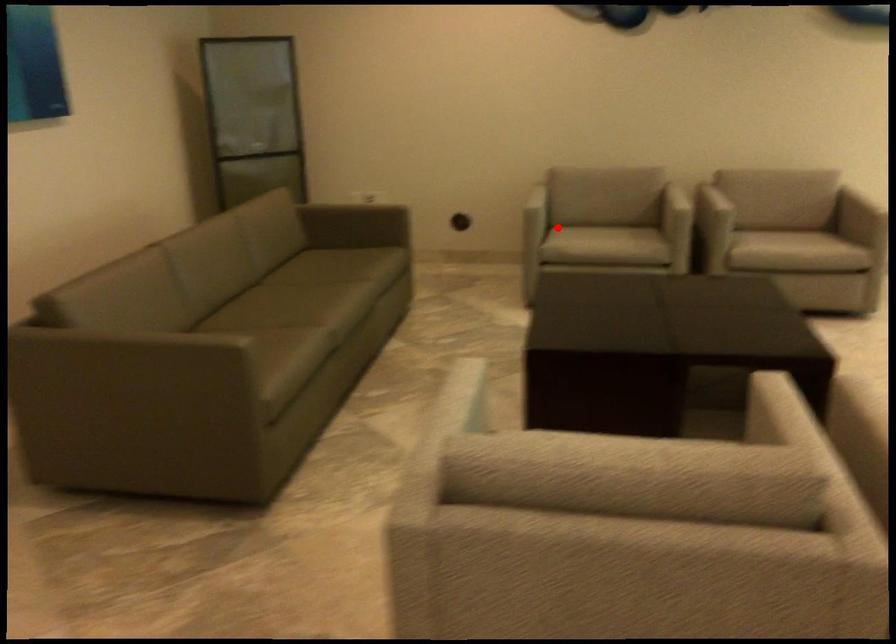
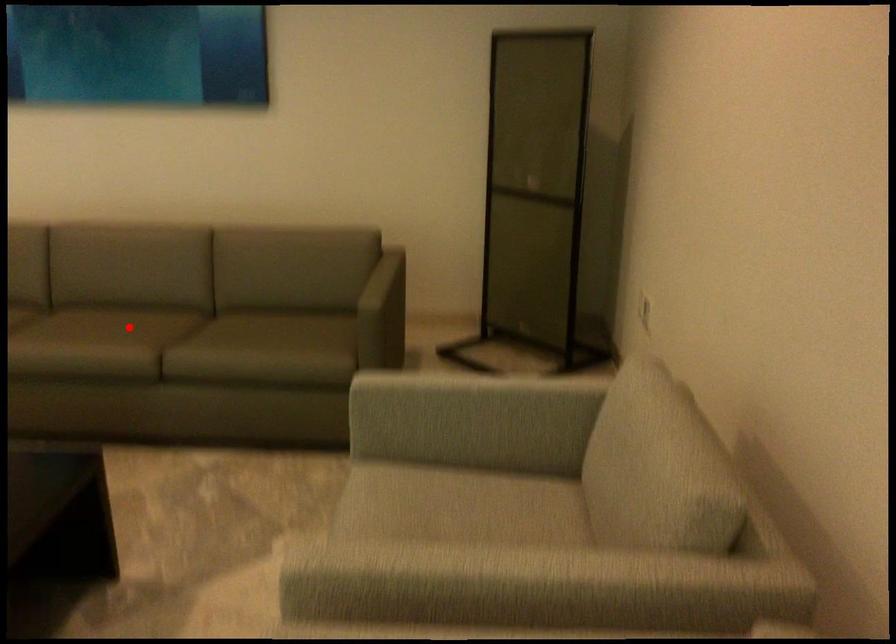
I am providing you with two images of the same scene from different viewpoints. A red point is marked on the first image and another point is marked on the second image. Is the marked point in image1 the same physical position as the marked point in image2?

No